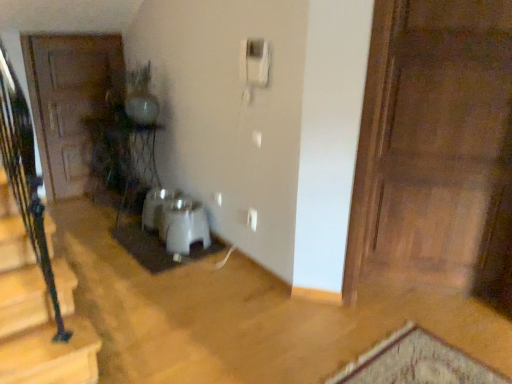
This screenshot has width=512, height=384. In order to click on vacant area that is in front of wooden door at right, which is the 2th door in left-to-right order in this screenshot , I will do `click(441, 345)`.